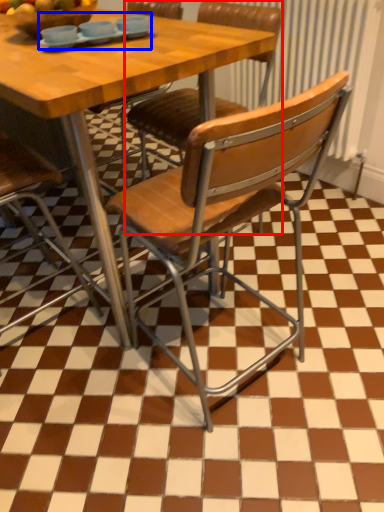
Question: Which point is closer to the camera, chair (highlighted by a red box) or tableware (highlighted by a blue box)?

Choices:
 (A) chair
 (B) tableware

Answer: (B)